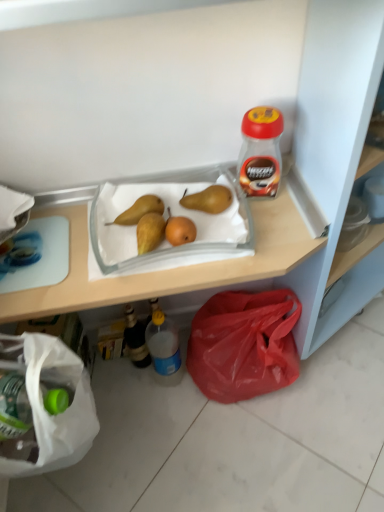
Question: From the image's perspective, is red plastic bag at lower right positioned above or below translucent glass bottle at lower left, which is the 2th bottle in bottom-to-top order?

Choices:
 (A) above
 (B) below

Answer: (A)

Question: Is point (195, 330) positioned closer to the camera than point (140, 335)?

Choices:
 (A) closer
 (B) farther

Answer: (B)

Question: Considering the real-world distances, which object is farthest from the red plastic bag at lower right?

Choices:
 (A) yellow matte pear at center, arranged as the first pear when viewed from the left
 (B) translucent plastic tray at upper center
 (C) brown matte pear at center, positioned as the 1th pear in right-to-left order
 (D) translucent glass bottle at lower left, the 2th bottle viewed from the top
 (E) translucent plastic bottle at lower center, which is counted as the second bottle, starting from the left

Answer: (A)

Question: Estimate the real-world distances between objects in this image. Which object is closer to the red plastic jar at upper right, which is counted as the first bottle, starting from the right?

Choices:
 (A) translucent plastic bottle at lower center, which is counted as the second bottle, starting from the left
 (B) translucent glass bottle at lower left, which is counted as the 1th bottle, starting from the left
 (C) translucent plastic tray at upper center
 (D) yellow matte pear at center, which ranks as the second pear in right-to-left order
 (E) brown matte pear at center, positioned as the 1th pear in right-to-left order

Answer: (E)